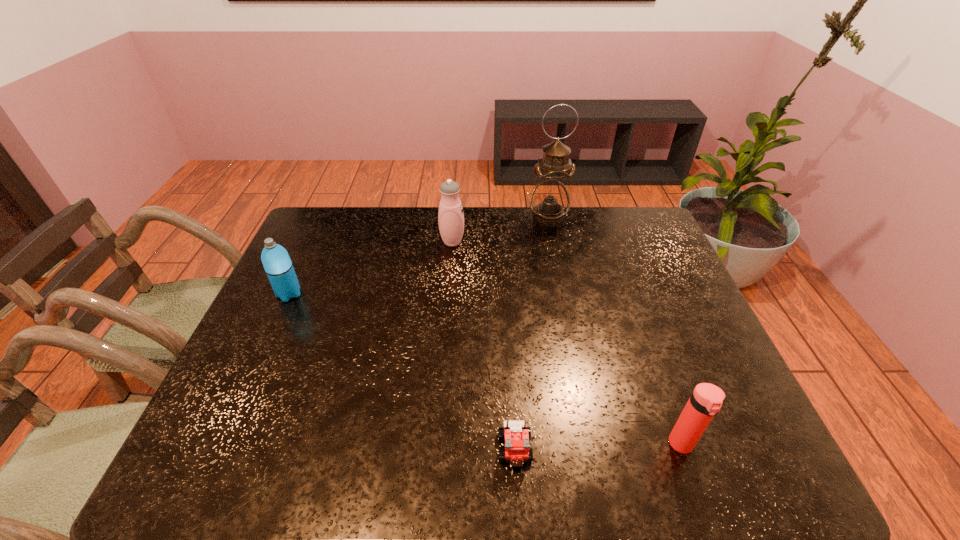
This screenshot has width=960, height=540. Find the location of `unoccupied position between the second object from right to left and the second object from left to right`. unoccupied position between the second object from right to left and the second object from left to right is located at coordinates (500, 230).

At what (x,y) coordinates should I click in order to perform the action: click on vacant area that lies between the leftmost thermos bottle and the rightmost thermos bottle. Please return your answer as a coordinate pair (x, y). The image size is (960, 540). Looking at the image, I should click on (485, 369).

The width and height of the screenshot is (960, 540). What are the coordinates of `free space between the second nearest thermos bottle and the tallest object` in the screenshot? It's located at (419, 256).

The image size is (960, 540). Identify the location of blank region between the third object from left to right and the third farthest object. (402, 372).

At what (x,y) coordinates should I click in order to perform the action: click on free space between the fourth nearest object and the nearest thermos bottle. Please return your answer as a coordinate pair (x, y). This screenshot has width=960, height=540. Looking at the image, I should click on (566, 343).

You are a GUI agent. You are given a task and a screenshot of the screen. Output one action in this format:
    pyautogui.click(x=<x>, y=<y>)
    Task: Click on the free space between the leftmost thermos bottle and the second thermos bottle from left to right
    This screenshot has height=540, width=960.
    Given the screenshot: What is the action you would take?
    pyautogui.click(x=371, y=268)

Image resolution: width=960 pixels, height=540 pixels. Find the location of `free spot between the third object from left to right and the farthest object`. free spot between the third object from left to right and the farthest object is located at coordinates (532, 334).

I want to click on free space between the second nearest thermos bottle and the fourth nearest object, so click(371, 268).

You are a GUI agent. You are given a task and a screenshot of the screen. Output one action in this format:
    pyautogui.click(x=<x>, y=<y>)
    Task: Click on the object identified as the fourth closest to the third object from left to right
    This screenshot has height=540, width=960.
    Given the screenshot: What is the action you would take?
    pyautogui.click(x=550, y=199)

Locate which object ranks third in proximity to the second farthest thermos bottle. Please provide its 2D coordinates. Your answer should be formatted as a tuple, i.e. [(x, y)], where the tuple contains the x and y coordinates of a point satisfying the conditions above.

[(550, 199)]